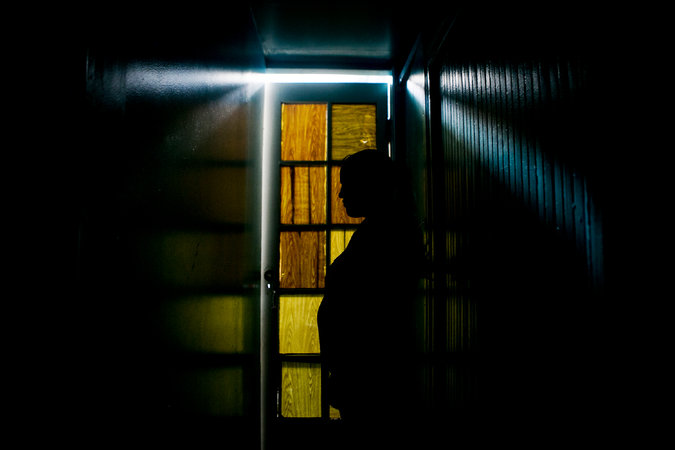
I want to click on walls, so [x=522, y=131], [x=198, y=147], [x=68, y=179].